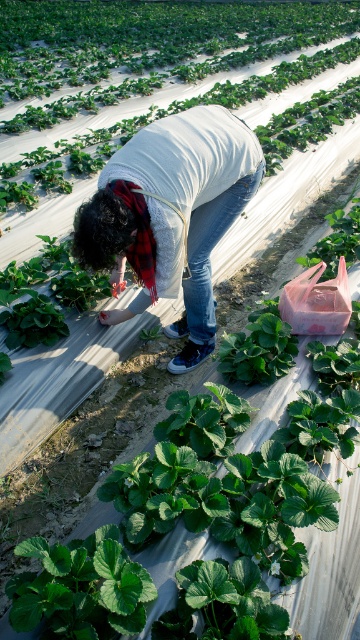
You are standing at the point marked as point (171, 216) in the strawberry field. What type of clothing is located exactly at that point?

Denim jeans are located exactly at point (171, 216).